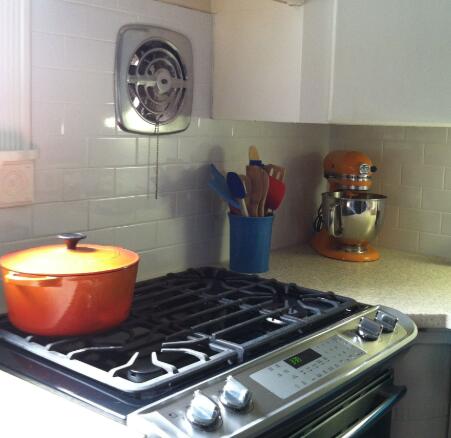
I want to click on stand mixer bowl, so click(x=352, y=223).